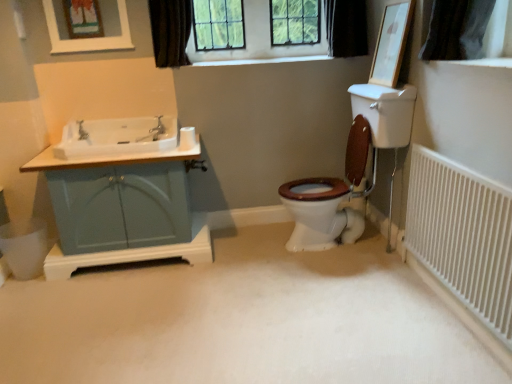
Question: Is brushed metal faucet at left not near black fabric curtain at upper center, acting as the 1th curtain starting from the right?

Choices:
 (A) yes
 (B) no

Answer: (A)

Question: Is brushed metal faucet at left to the right of black fabric curtain at upper center, the 2th curtain in the left-to-right sequence, from the viewer's perspective?

Choices:
 (A) no
 (B) yes

Answer: (A)

Question: Considering the relative sizes of brushed metal faucet at left and black fabric curtain at upper center, the 2th curtain in the left-to-right sequence, in the image provided, is brushed metal faucet at left shorter than black fabric curtain at upper center, the 2th curtain in the left-to-right sequence,?

Choices:
 (A) yes
 (B) no

Answer: (A)

Question: Does brushed metal faucet at left have a greater width compared to black fabric curtain at upper center, acting as the 1th curtain starting from the right?

Choices:
 (A) no
 (B) yes

Answer: (A)

Question: From a real-world perspective, is brushed metal faucet at left on top of black fabric curtain at upper center, acting as the 1th curtain starting from the right?

Choices:
 (A) yes
 (B) no

Answer: (B)

Question: Based on their positions, is dark fabric curtain at upper center, the second curtain positioned from the right, located to the left or right of white matte carpet at center?

Choices:
 (A) right
 (B) left

Answer: (B)

Question: From the image's perspective, is dark fabric curtain at upper center, the second curtain positioned from the right, located above or below white matte carpet at center?

Choices:
 (A) above
 (B) below

Answer: (A)

Question: In terms of size, does dark fabric curtain at upper center, the second curtain positioned from the right, appear bigger or smaller than white matte carpet at center?

Choices:
 (A) small
 (B) big

Answer: (A)

Question: Is point (167, 51) positioned closer to the camera than point (129, 345)?

Choices:
 (A) closer
 (B) farther

Answer: (B)

Question: Visually, is brushed metal faucet at left positioned to the left or to the right of white glossy sink at left?

Choices:
 (A) left
 (B) right

Answer: (A)

Question: Is brushed metal faucet at left wider or thinner than white glossy sink at left?

Choices:
 (A) wide
 (B) thin

Answer: (B)

Question: Is point (86, 132) positioned closer to the camera than point (92, 153)?

Choices:
 (A) closer
 (B) farther

Answer: (B)

Question: Is brushed metal faucet at left bigger or smaller than white glossy sink at left?

Choices:
 (A) big
 (B) small

Answer: (B)

Question: From the image's perspective, is black fabric curtain at upper center, acting as the 1th curtain starting from the right, above or below wooden picture frame at upper right, which is counted as the second picture frame, starting from the left?

Choices:
 (A) below
 (B) above

Answer: (B)

Question: Considering the positions of black fabric curtain at upper center, acting as the 1th curtain starting from the right, and wooden picture frame at upper right, which ranks as the first picture frame in right-to-left order, in the image, is black fabric curtain at upper center, acting as the 1th curtain starting from the right, bigger or smaller than wooden picture frame at upper right, which ranks as the first picture frame in right-to-left order,?

Choices:
 (A) big
 (B) small

Answer: (A)